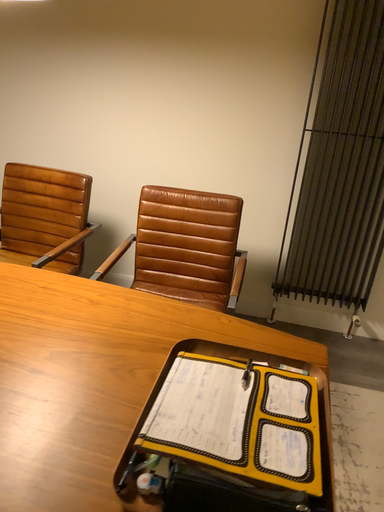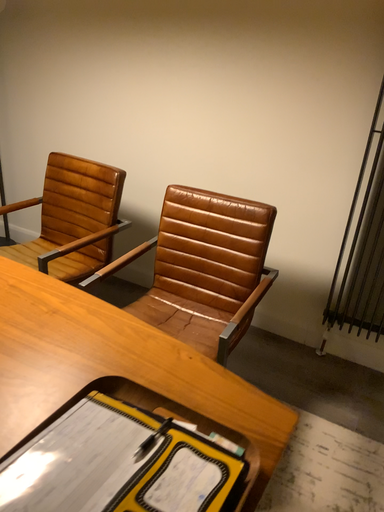
Question: Which way did the camera rotate in the video?

Choices:
 (A) rotated right
 (B) rotated left

Answer: (B)